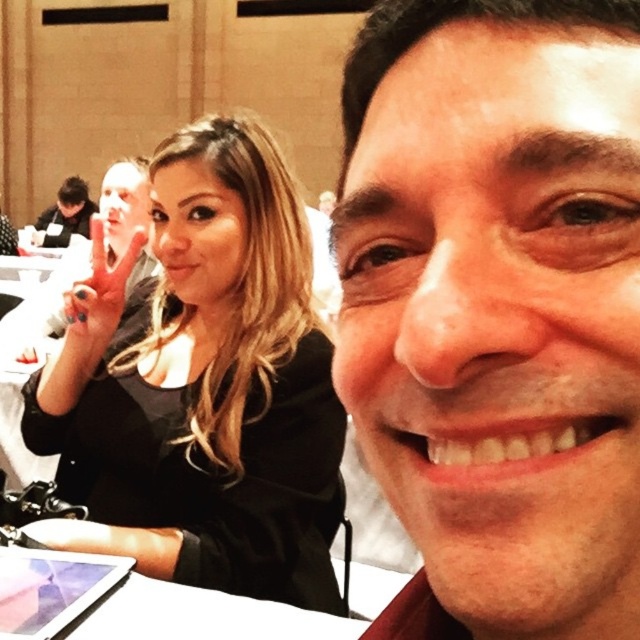
Question: Which of the following is the farthest from the observer?

Choices:
 (A) smooth skin face at center
 (B) black matte hair at upper left

Answer: (B)

Question: Among these objects, which one is nearest to the camera?

Choices:
 (A) smooth skin face at center
 (B) black matte hair at upper left

Answer: (A)

Question: Can you confirm if smooth skin face at center is thinner than black matte hair at upper left?

Choices:
 (A) yes
 (B) no

Answer: (A)

Question: Does smooth skin face at center have a smaller size compared to black matte hair at upper left?

Choices:
 (A) yes
 (B) no

Answer: (A)

Question: Can you confirm if smooth skin face at center is positioned above black matte hair at upper left?

Choices:
 (A) no
 (B) yes

Answer: (B)